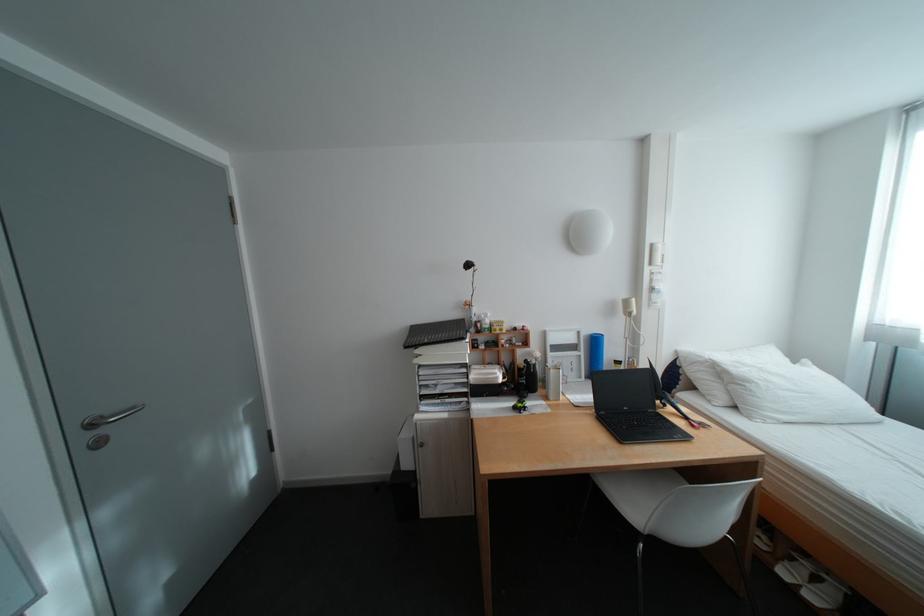
Describe the element at coordinates (99, 442) in the screenshot. I see `a silver door handle` at that location.